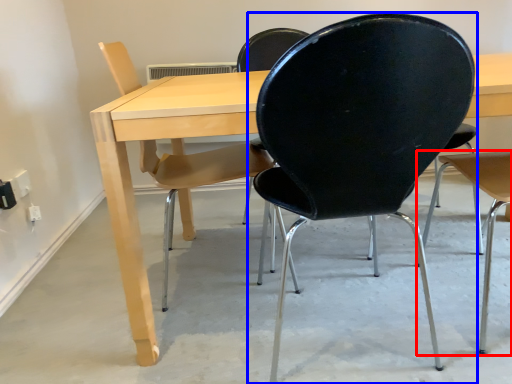
Question: Which object is further to the camera taking this photo, chair (highlighted by a red box) or chair (highlighted by a blue box)?

Choices:
 (A) chair
 (B) chair

Answer: (A)